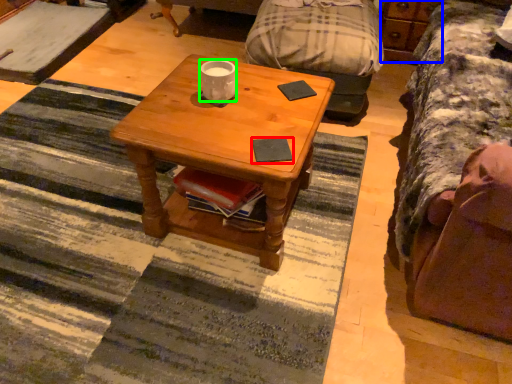
Question: Which is farther away from pad (highlighted by a red box)? dresser (highlighted by a blue box) or coffee cup (highlighted by a green box)?

Choices:
 (A) dresser
 (B) coffee cup

Answer: (A)